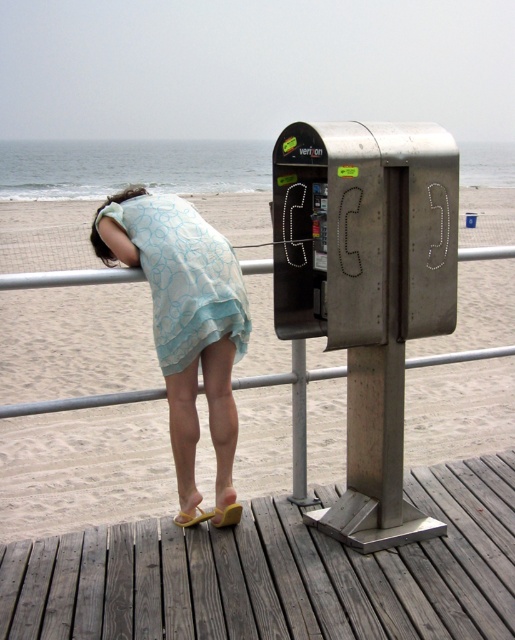
You are standing on the beach and want to reach the wooden dock at lower center. What are the coordinates where you should head towards?

You should head towards the coordinates point (278, 572) to reach the wooden dock at lower center.

You are a delivery robot with a 2.5 feet wide package. You need to navigate between the wooden dock at lower center and the light blue sheer dress at center to reach the delivery point. Can you fit through the space between them?

The wooden dock at lower center is 3.32 feet away from the light blue sheer dress at center. Since the package is 2.5 feet wide, the space between them is sufficient for the package to pass through.

You are standing at the beach and see two points marked on the wooden planks of the pier. The first point is at coordinates point (74, 292) and the second is at point (187, 522). Which point is closer to you?

Point (74, 292) is closer to you because it is further to the viewer than point (187, 522).